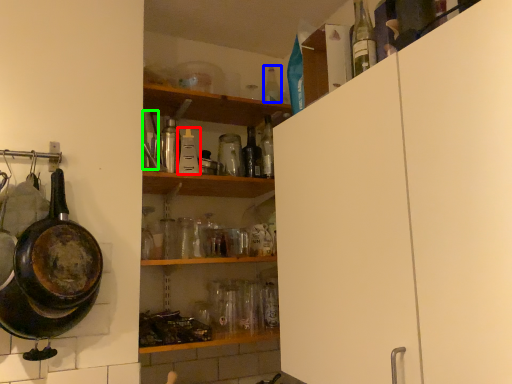
Question: Considering the real-world distances, which object is farthest from bottle (highlighted by a red box)? bottle (highlighted by a blue box) or bottle (highlighted by a green box)?

Choices:
 (A) bottle
 (B) bottle

Answer: (A)